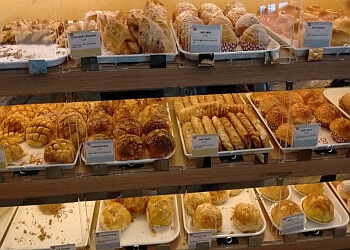
The height and width of the screenshot is (250, 350). What are the coordinates of `brown shelves` in the screenshot? It's located at (181, 175), (176, 79), (269, 240).